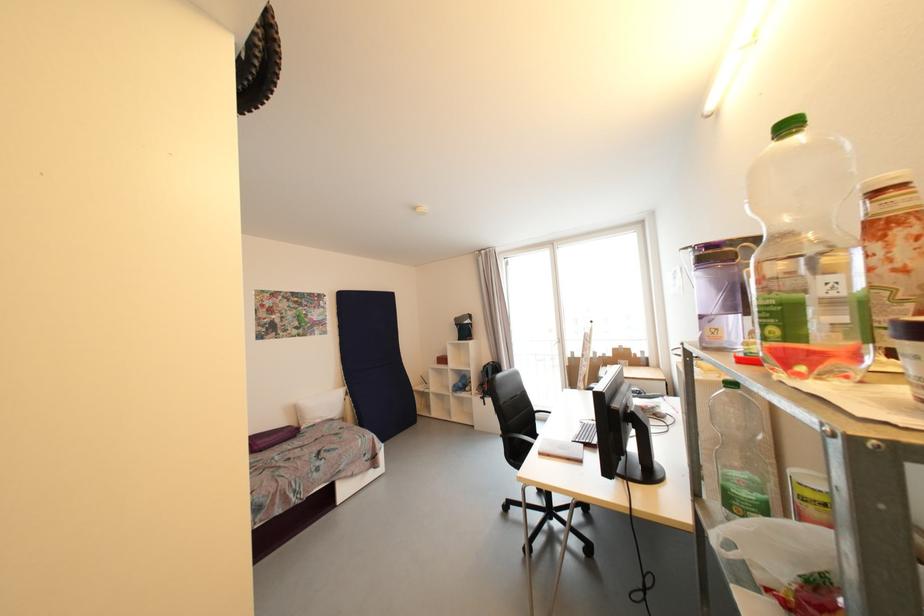
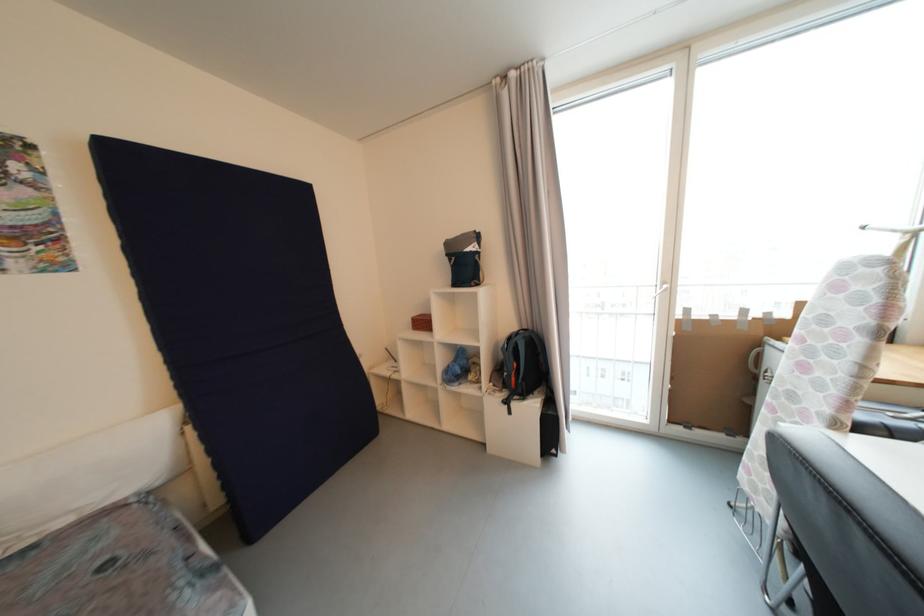
Question: What movement of the cameraman would produce the second image?

Choices:
 (A) Left
 (B) Right
 (C) Forward
 (D) Backward

Answer: (C)